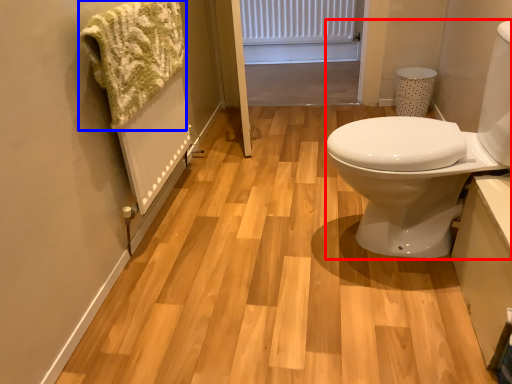
Question: Which of the following is the farthest to the observer, sink (highlighted by a red box) or bath towel (highlighted by a blue box)?

Choices:
 (A) sink
 (B) bath towel

Answer: (B)